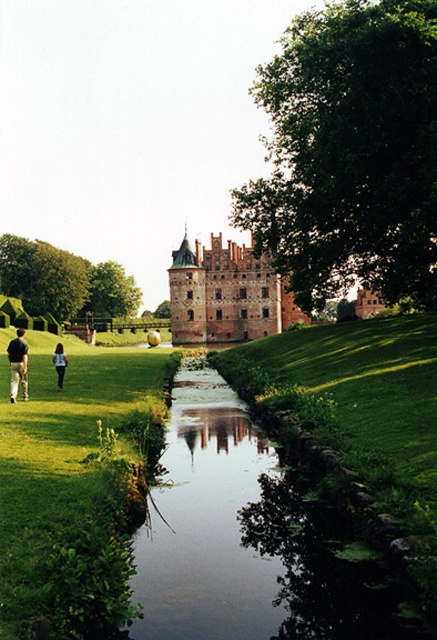
Question: Does brown stone castle at center appear under blue fabric backpack at lower left?

Choices:
 (A) yes
 (B) no

Answer: (B)

Question: Is brown stone castle at center closer to camera compared to blue fabric backpack at lower left?

Choices:
 (A) no
 (B) yes

Answer: (A)

Question: Is brown stone castle at center bigger than blue fabric backpack at lower left?

Choices:
 (A) yes
 (B) no

Answer: (A)

Question: Among these objects, which one is farthest from the camera?

Choices:
 (A) dark brown leather pants at lower left
 (B) blue fabric backpack at lower left

Answer: (B)

Question: Estimate the real-world distances between objects in this image. Which object is farther from the dark brown leather pants at lower left?

Choices:
 (A) brown stone castle at center
 (B) blue fabric backpack at lower left

Answer: (A)

Question: Which of the following is the closest to the observer?

Choices:
 (A) (17, 372)
 (B) (280, 296)

Answer: (A)